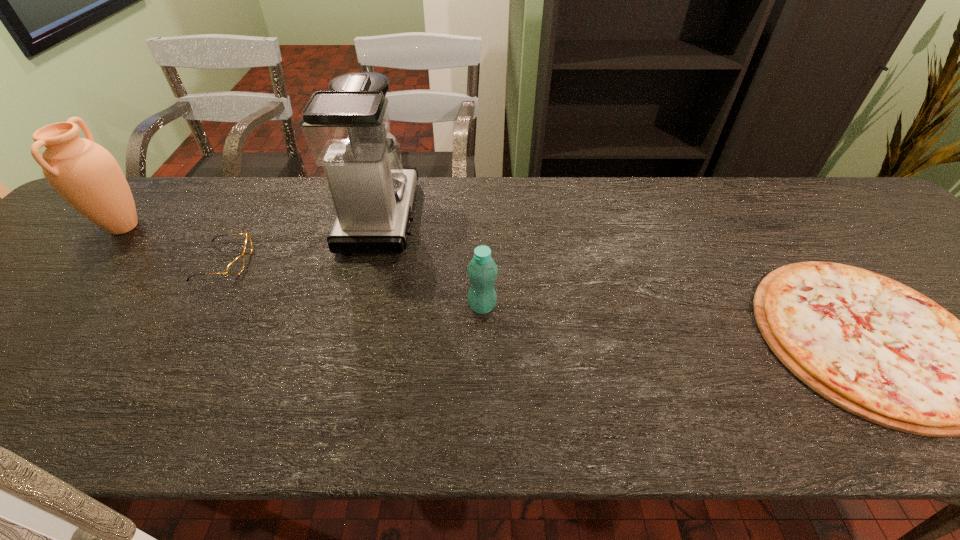
Image resolution: width=960 pixels, height=540 pixels. What are the coordinates of `free space located at the front cap of the second object from right to left` in the screenshot? It's located at (345, 307).

Locate an element on the screen. Image resolution: width=960 pixels, height=540 pixels. blank space located at the front cap of the second object from right to left is located at coordinates (411, 307).

The image size is (960, 540). Identify the location of free location located 0.080m at the front cap of the second object from right to left. (433, 307).

This screenshot has width=960, height=540. Identify the location of vacant area situated on the front-facing side of the second object from left to right. (385, 262).

The height and width of the screenshot is (540, 960). I want to click on coffee maker that is at the far edge, so click(x=347, y=129).

This screenshot has height=540, width=960. Find the location of `urn present at the far edge`. urn present at the far edge is located at coordinates (85, 174).

At what (x,y) coordinates should I click in order to perform the action: click on object at the left edge. Please return your answer as a coordinate pair (x, y). The image size is (960, 540). Looking at the image, I should click on (85, 174).

Image resolution: width=960 pixels, height=540 pixels. What are the coordinates of `object that is at the far left corner` in the screenshot? It's located at (85, 174).

You are a GUI agent. You are given a task and a screenshot of the screen. Output one action in this format:
    pyautogui.click(x=<x>, y=<y>)
    Task: Click on the vacant region at the far edge of the desktop
    
    Given the screenshot: What is the action you would take?
    pyautogui.click(x=513, y=183)

This screenshot has height=540, width=960. What are the coordinates of `vacant point at the near edge` in the screenshot? It's located at (367, 422).